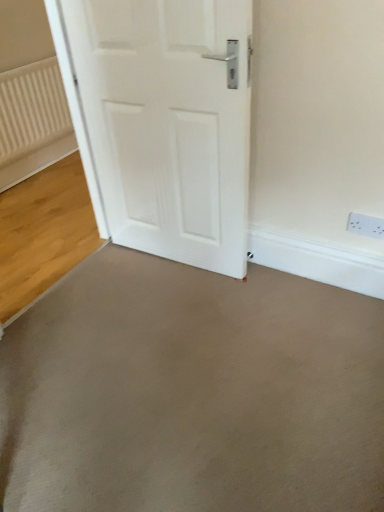
Question: Is smooth concrete floor at center, the 1th concrete positioned from the front, to the right of gray smooth concrete at center, the 2th concrete viewed from the front, from the viewer's perspective?

Choices:
 (A) no
 (B) yes

Answer: (B)

Question: Considering the relative sizes of smooth concrete floor at center, the 1th concrete positioned from the front, and gray smooth concrete at center, the 2th concrete viewed from the front, in the image provided, is smooth concrete floor at center, the 1th concrete positioned from the front, bigger than gray smooth concrete at center, the 2th concrete viewed from the front,?

Choices:
 (A) no
 (B) yes

Answer: (B)

Question: From the image's perspective, is smooth concrete floor at center, the 1th concrete positioned from the front, above gray smooth concrete at center, which appears as the first concrete when viewed from the back?

Choices:
 (A) no
 (B) yes

Answer: (A)

Question: Is there a large distance between smooth concrete floor at center, the 1th concrete positioned from the front, and gray smooth concrete at center, which appears as the first concrete when viewed from the back?

Choices:
 (A) no
 (B) yes

Answer: (A)

Question: Is smooth concrete floor at center, arranged as the second concrete when viewed from the back, oriented towards gray smooth concrete at center, which appears as the first concrete when viewed from the back?

Choices:
 (A) no
 (B) yes

Answer: (B)

Question: Would you say white textured radiator at left is to the left or to the right of smooth concrete floor at center, the 1th concrete positioned from the front, in the picture?

Choices:
 (A) right
 (B) left

Answer: (B)

Question: Is white textured radiator at left inside or outside of smooth concrete floor at center, arranged as the second concrete when viewed from the back?

Choices:
 (A) outside
 (B) inside

Answer: (A)

Question: From a real-world perspective, is white textured radiator at left physically located above or below smooth concrete floor at center, the 1th concrete positioned from the front?

Choices:
 (A) below
 (B) above

Answer: (B)

Question: From the image's perspective, relative to smooth concrete floor at center, arranged as the second concrete when viewed from the back, is white textured radiator at left above or below?

Choices:
 (A) below
 (B) above

Answer: (B)

Question: Is white plastic electric outlet at upper right to the left or to the right of gray smooth concrete at center, the 2th concrete viewed from the front, in the image?

Choices:
 (A) right
 (B) left

Answer: (A)

Question: Considering the positions of white plastic electric outlet at upper right and gray smooth concrete at center, which appears as the first concrete when viewed from the back, in the image, is white plastic electric outlet at upper right wider or thinner than gray smooth concrete at center, which appears as the first concrete when viewed from the back,?

Choices:
 (A) wide
 (B) thin

Answer: (B)

Question: Is white plastic electric outlet at upper right inside the boundaries of gray smooth concrete at center, the 2th concrete viewed from the front, or outside?

Choices:
 (A) inside
 (B) outside

Answer: (B)

Question: Considering their positions, is white plastic electric outlet at upper right located in front of or behind gray smooth concrete at center, which appears as the first concrete when viewed from the back?

Choices:
 (A) behind
 (B) front

Answer: (B)

Question: Looking at the image, does white textured radiator at left seem bigger or smaller compared to white plastic electric outlet at upper right?

Choices:
 (A) big
 (B) small

Answer: (A)

Question: From the image's perspective, is white textured radiator at left located above or below white plastic electric outlet at upper right?

Choices:
 (A) above
 (B) below

Answer: (A)